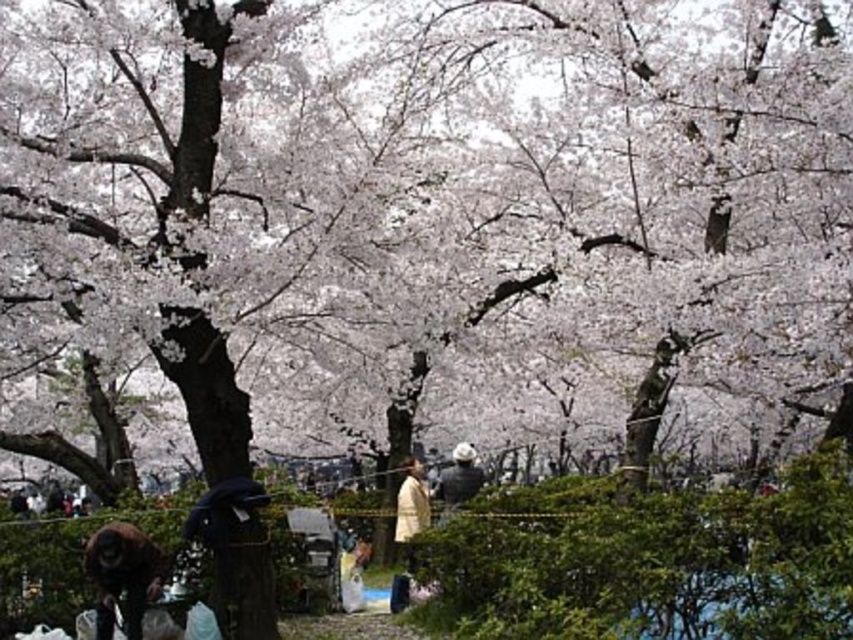
You are standing at the center of the park and see the brown fur monkey at lower left and the light beige fabric coat at center. Which object is closer to you?

The light beige fabric coat at center is closer to you since it is located at the center, while the brown fur monkey at lower left is 64.85 feet away.

You are a person standing at the center of the park. You see a light beige fabric coat at center and a white matte jacket at center. You want to pick up both items without moving from your current position. Is it possible?

The distance between the light beige fabric coat at center and the white matte jacket at center is 4.81 meters. Since you cannot reach 4.81 meters without moving, you cannot pick up both items without moving.